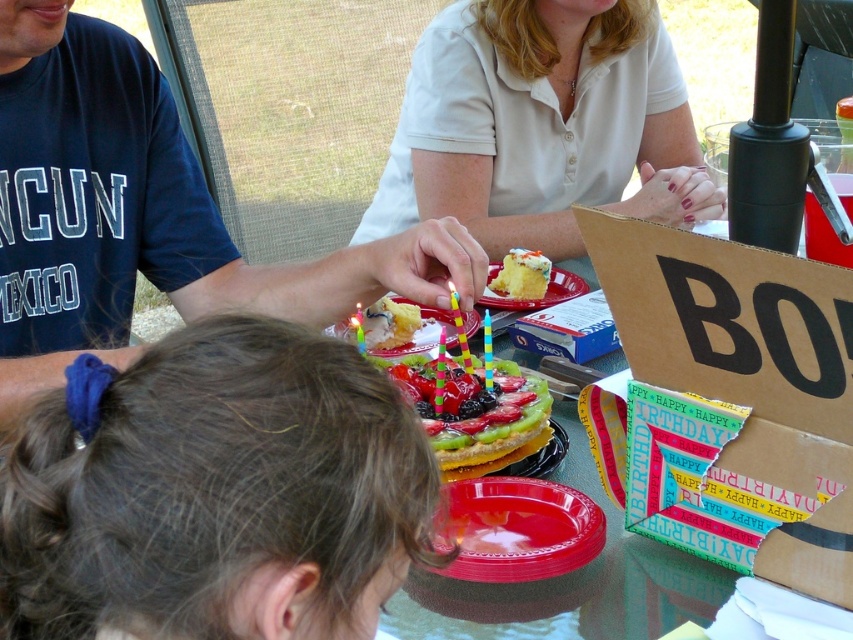
Question: Is yellow sponge cake at center closer to the viewer compared to multicolored plastic candle at center?

Choices:
 (A) yes
 (B) no

Answer: (B)

Question: Which of the following is the closest to the observer?

Choices:
 (A) multicolored plastic candle at center
 (B) yellow cake at center
 (C) yellow sponge cake at center

Answer: (A)

Question: Is blue cotton shirt at center further to camera compared to multicolored plastic birthday candle at center?

Choices:
 (A) no
 (B) yes

Answer: (A)

Question: Can you confirm if blue cotton shirt at center is positioned above yellow sponge cake at center?

Choices:
 (A) yes
 (B) no

Answer: (A)

Question: Which of these objects is positioned closest to the frosted fruit cake at center?

Choices:
 (A) brown hair at center
 (B) yellow cake at center

Answer: (B)

Question: Which object is positioned closest to the yellow cake at center?

Choices:
 (A) yellow sponge cake at center
 (B) brown hair at center
 (C) multicolored plastic birthday candle at center
 (D) multicolored plastic candle at center

Answer: (C)